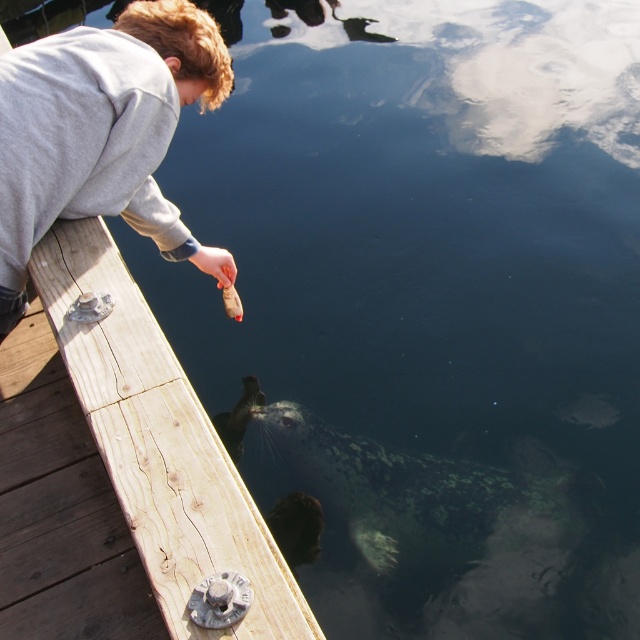
Question: Where is brown wooden dock at lower left located in relation to gray matte sweatshirt at upper left in the image?

Choices:
 (A) above
 (B) below

Answer: (B)

Question: From the image, what is the correct spatial relationship of brown wooden dock at lower left in relation to gray matte sweatshirt at upper left?

Choices:
 (A) left
 (B) right

Answer: (B)

Question: Which object is farther from the camera taking this photo?

Choices:
 (A) brown wooden dock at lower left
 (B) gray matte sweatshirt at upper left

Answer: (B)

Question: Which of the following is the closest to the observer?

Choices:
 (A) (266, 618)
 (B) (112, 70)

Answer: (A)

Question: From the image, what is the correct spatial relationship of brown wooden dock at lower left in relation to gray matte sweatshirt at upper left?

Choices:
 (A) right
 (B) left

Answer: (A)